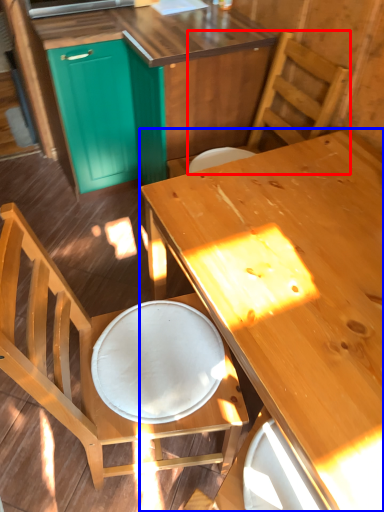
Question: Which object appears closest to the camera in this image, chair (highlighted by a red box) or desk (highlighted by a blue box)?

Choices:
 (A) chair
 (B) desk

Answer: (B)